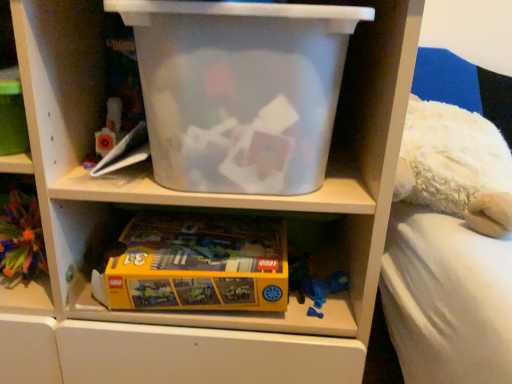
Question: Can you confirm if transparent plastic storage box at upper center is wider than yellow cardboard lego box at lower center?

Choices:
 (A) yes
 (B) no

Answer: (B)

Question: Would you say yellow cardboard lego box at lower center is part of transparent plastic storage box at upper center's contents?

Choices:
 (A) yes
 (B) no

Answer: (B)

Question: Is transparent plastic storage box at upper center beside yellow cardboard lego box at lower center?

Choices:
 (A) no
 (B) yes

Answer: (A)

Question: Considering the relative sizes of transparent plastic storage box at upper center and yellow cardboard lego box at lower center in the image provided, is transparent plastic storage box at upper center bigger than yellow cardboard lego box at lower center?

Choices:
 (A) yes
 (B) no

Answer: (A)

Question: Is transparent plastic storage box at upper center thinner than yellow cardboard lego box at lower center?

Choices:
 (A) no
 (B) yes

Answer: (B)

Question: From the image's perspective, is transparent plastic storage box at upper center located above or below yellow cardboard lego box at lower center?

Choices:
 (A) below
 (B) above

Answer: (B)

Question: In terms of width, does transparent plastic storage box at upper center look wider or thinner when compared to yellow cardboard lego box at lower center?

Choices:
 (A) thin
 (B) wide

Answer: (A)

Question: From a real-world perspective, is transparent plastic storage box at upper center positioned above or below yellow cardboard lego box at lower center?

Choices:
 (A) below
 (B) above

Answer: (B)

Question: Would you say transparent plastic storage box at upper center is inside or outside yellow cardboard lego box at lower center?

Choices:
 (A) outside
 (B) inside

Answer: (A)

Question: From the image's perspective, is transparent plastic storage box at upper center positioned above or below yellow matte lego box at lower left?

Choices:
 (A) above
 (B) below

Answer: (A)

Question: Would you say transparent plastic storage box at upper center is to the left or to the right of yellow matte lego box at lower left in the picture?

Choices:
 (A) left
 (B) right

Answer: (B)

Question: Considering the positions of transparent plastic storage box at upper center and yellow matte lego box at lower left in the image, is transparent plastic storage box at upper center wider or thinner than yellow matte lego box at lower left?

Choices:
 (A) thin
 (B) wide

Answer: (B)

Question: Is transparent plastic storage box at upper center situated inside yellow matte lego box at lower left or outside?

Choices:
 (A) inside
 (B) outside

Answer: (B)

Question: Considering the positions of yellow cardboard lego box at lower center and yellow matte lego box at lower left in the image, is yellow cardboard lego box at lower center wider or thinner than yellow matte lego box at lower left?

Choices:
 (A) thin
 (B) wide

Answer: (B)

Question: Considering the positions of point (104, 296) and point (2, 183), is point (104, 296) closer or farther from the camera than point (2, 183)?

Choices:
 (A) farther
 (B) closer

Answer: (A)